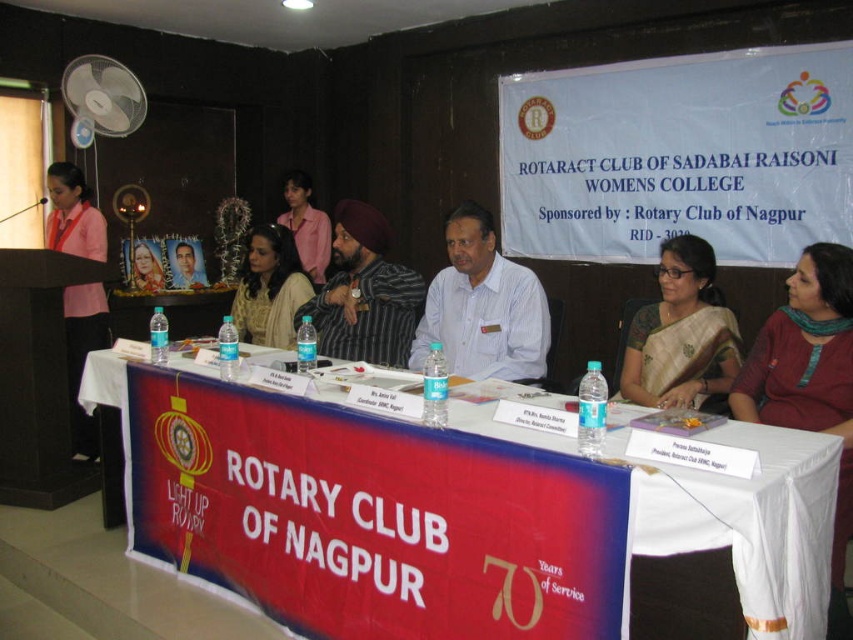
Does point (462, 250) come farther from viewer compared to point (265, 272)?

No, (462, 250) is in front of (265, 272).

Which is in front, point (476, 211) or point (270, 275)?

Point (476, 211) is more forward.

The image size is (853, 640). What do you see at coordinates (483, 307) in the screenshot?
I see `white shirt at center` at bounding box center [483, 307].

In order to click on white shirt at center in this screenshot , I will do `click(483, 307)`.

Which of these two, maroon fabric dress at lower right or matte black dress at center, stands taller?

Standing taller between the two is maroon fabric dress at lower right.

Which is behind, point (840, 502) or point (287, 243)?

The point (287, 243) is more distant.

This screenshot has width=853, height=640. Find the location of `maroon fabric dress at lower right`. maroon fabric dress at lower right is located at coordinates (809, 381).

Who is shorter, matte black turban at center or pink fabric at left?

matte black turban at center

Which is in front, point (398, 356) or point (51, 172)?

Point (398, 356) is more forward.

Is point (323, 301) less distant than point (68, 250)?

Yes, point (323, 301) is closer to viewer.

Find the location of a particular element. The width and height of the screenshot is (853, 640). matte black turban at center is located at coordinates (364, 292).